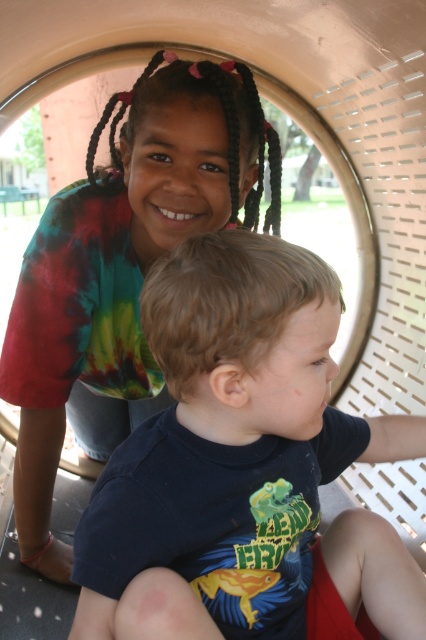
You are standing at the entrance of the playground tunnel and see two points marked inside the tunnel. The first point is at coordinates point [146,428] and the second is at point [273,179]. Which point is closer to you as you enter the tunnel?

Point [146,428] is closer to the viewer than point [273,179], so the first point is closer to you as you enter the tunnel.